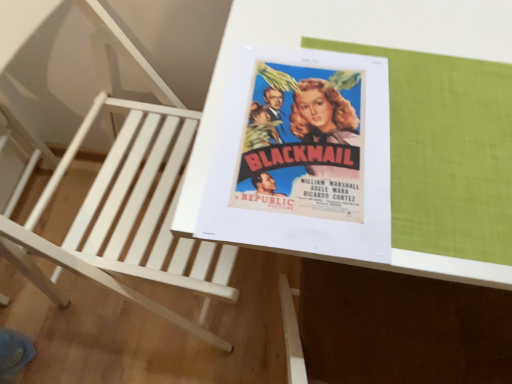
Where is `vacant space to the right of matte paper poster at center`? The height and width of the screenshot is (384, 512). vacant space to the right of matte paper poster at center is located at coordinates tap(445, 132).